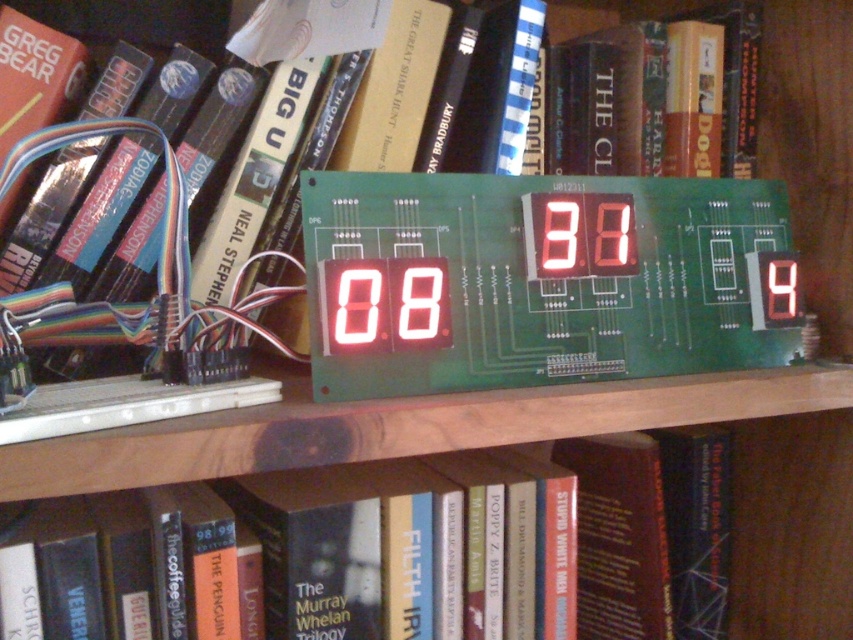
Based on the photo, you are organizing a shelf and need to place a new item between the hardcover book at center and the white led display at center. The new item is 15 cm wide. Can it fit in the space between them?

The hardcover book at center is wider than the white led display at center. Since the exact width of the space between them isn

What are the coordinates of the hardcover book at center?

The hardcover book at center is located at point [393,548].